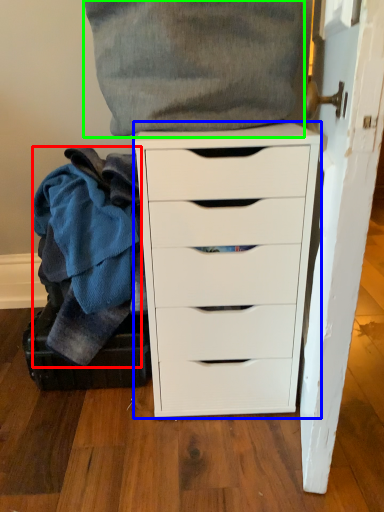
Question: Which object is the closest to the clothing (highlighted by a red box)? Choose among these: chest of drawers (highlighted by a blue box) or clothing (highlighted by a green box).

Choices:
 (A) chest of drawers
 (B) clothing

Answer: (A)